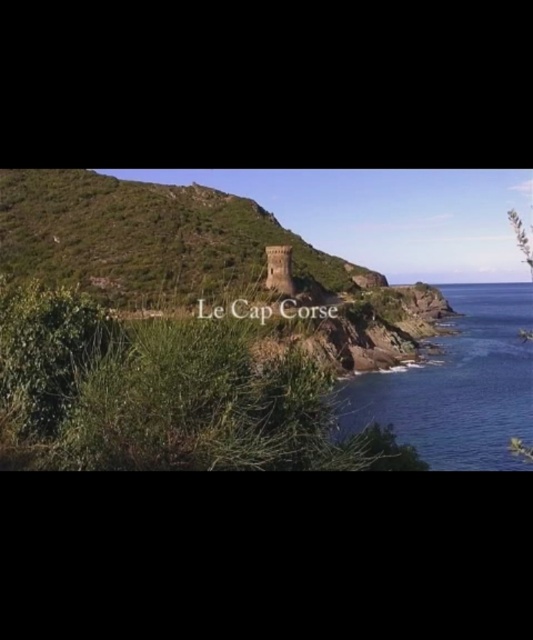
Between green grassy hillside at center and blue glossy water at lower right, which one is positioned higher?

green grassy hillside at center is above.

Is point (130, 266) less distant than point (477, 401)?

That is False.

Locate an element on the screen. Image resolution: width=533 pixels, height=640 pixels. green grassy hillside at center is located at coordinates (151, 240).